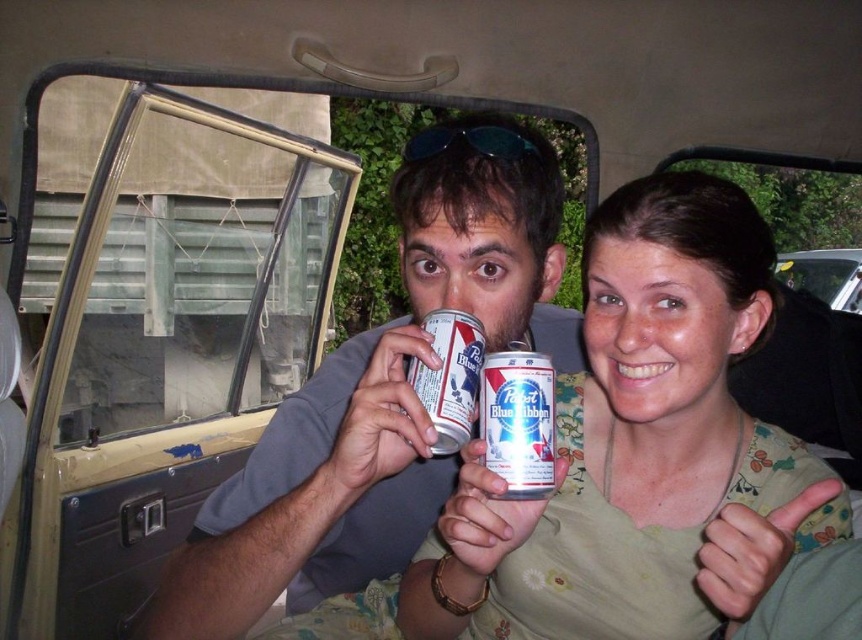
You are a bartender who needs to pour the contents of both the blue metallic can at center and the matte silver can at center into a single glass. Which can should you pour first to ensure the glass doesn t overflow?

The blue metallic can at center is bigger than the matte silver can at center, so you should pour the contents of the blue metallic can at center first to ensure the glass doesn t overflow.

You are inside the vintage Jeep and want to place a small item on the closest point between point (551, 474) and point (440, 332). Which point should you choose?

Point (551, 474) is closer to the viewer than point (440, 332), so you should place the item on point (551, 474).

You are a photographer taking a picture of the matte green blouse at center and the blue metallic can at center. Which object should you focus on first if you want to capture both in the frame without moving the camera? Explain your reasoning based on their positions.

You should focus on the matte green blouse at center first because it is positioned to the right of the blue metallic can at center, so adjusting focus to the right ensures both are in the frame without moving the camera.